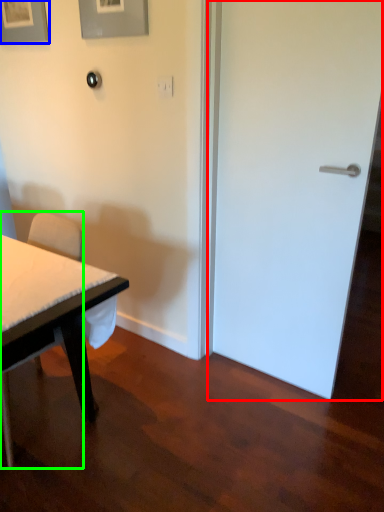
Question: Considering the real-world distances, which object is closest to door (highlighted by a red box)? picture frame (highlighted by a blue box) or chair (highlighted by a green box).

Choices:
 (A) picture frame
 (B) chair

Answer: (B)